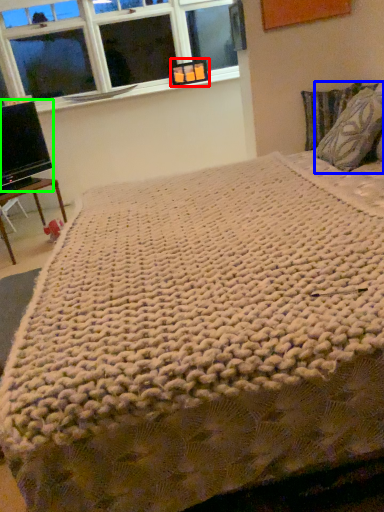
Question: Considering the real-world distances, which object is farthest from picture frame (highlighted by a red box)? pillow (highlighted by a blue box) or computer monitor (highlighted by a green box)?

Choices:
 (A) pillow
 (B) computer monitor

Answer: (A)